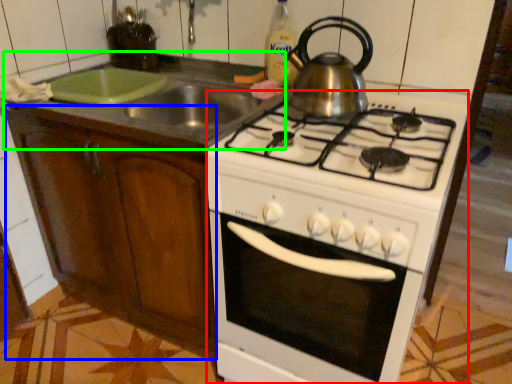
Question: Considering the real-world distances, which object is farthest from oven (highlighted by a red box)? cabinetry (highlighted by a blue box) or counter top (highlighted by a green box)?

Choices:
 (A) cabinetry
 (B) counter top

Answer: (B)